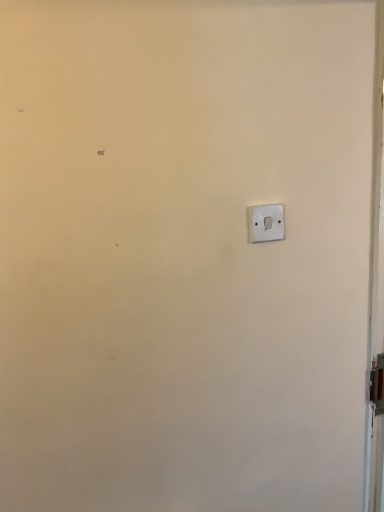
This screenshot has height=512, width=384. What do you see at coordinates (266, 222) in the screenshot?
I see `white plastic socket at center-right` at bounding box center [266, 222].

The width and height of the screenshot is (384, 512). Identify the location of white plastic socket at center-right. (266, 222).

I want to click on white plastic socket at center-right, so pyautogui.click(x=266, y=222).